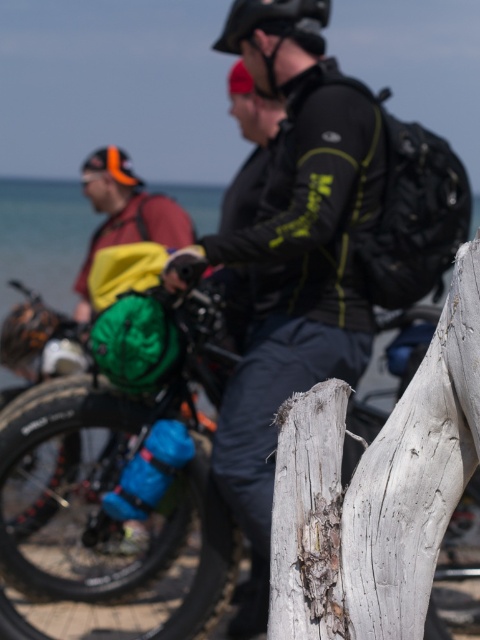
Between matte black bicycle at center and matte black jacket at center, which one has less height?

With less height is matte black bicycle at center.

Measure the distance between point (24, 556) and camera.

The distance of point (24, 556) from camera is 22.00 feet.

The height and width of the screenshot is (640, 480). Identify the location of matte black bicycle at center. (104, 509).